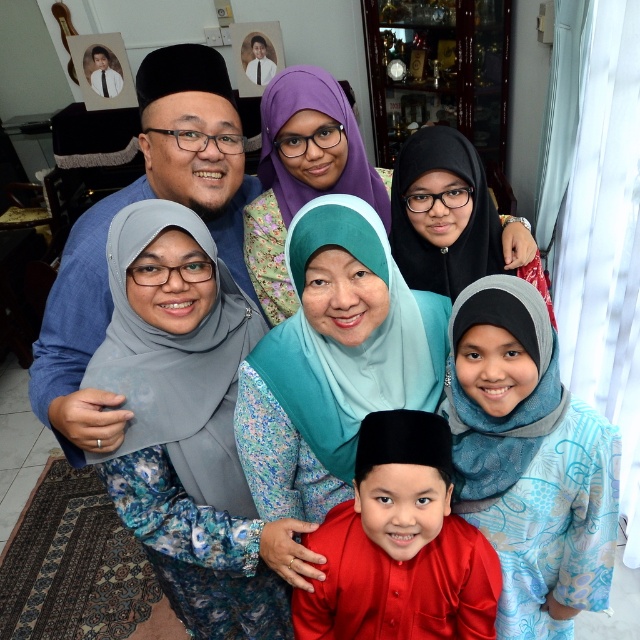
Question: Which of the following is the farthest from the observer?

Choices:
 (A) (461, 308)
 (B) (260, 420)
 (C) (179, 346)
 (D) (332, 602)

Answer: (B)

Question: In this image, where is blue patterned hijab at center located relative to black satin hijab at upper right?

Choices:
 (A) above
 (B) below

Answer: (B)

Question: Estimate the real-world distances between objects in this image. Which object is farther from the blue patterned hijab at center?

Choices:
 (A) purple satin hijab at center
 (B) teal satin hijab at center
 (C) silky red shirt at center

Answer: (A)

Question: Does blue patterned hijab at center have a greater width compared to teal satin hijab at center?

Choices:
 (A) no
 (B) yes

Answer: (A)

Question: Can you confirm if blue patterned hijab at center is wider than black satin hijab at upper right?

Choices:
 (A) no
 (B) yes

Answer: (A)

Question: Which object is farther from the camera taking this photo?

Choices:
 (A) teal satin hijab at center
 (B) silky red shirt at center

Answer: (A)